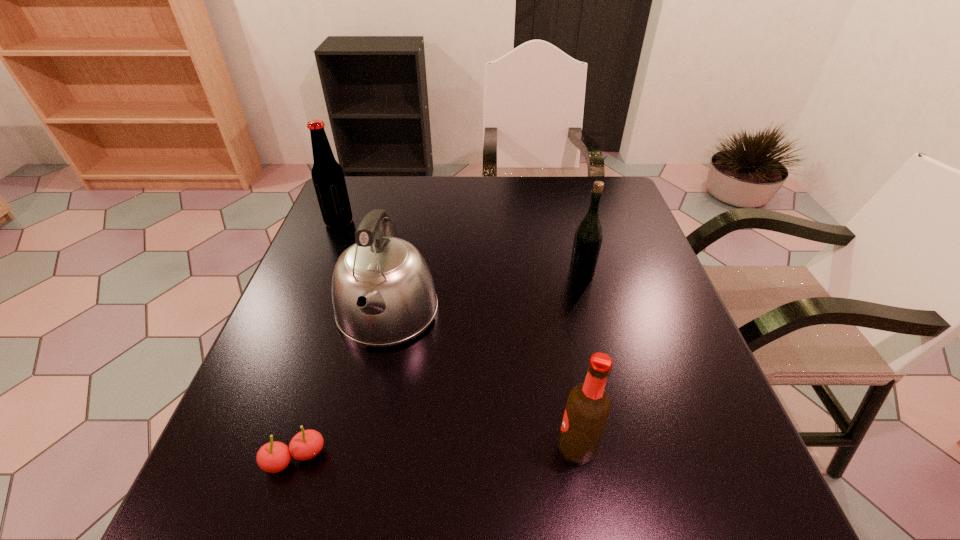
Identify the location of vacant area situated on the left of the rightmost object. [x=528, y=275].

This screenshot has height=540, width=960. I want to click on vacant area situated 0.050m on the back of the second beer bottle from right to left, so click(569, 403).

Locate an element on the screen. vacant space located 0.060m on the back of the cherry is located at coordinates (311, 408).

I want to click on object at the far edge, so click(328, 178).

The height and width of the screenshot is (540, 960). What are the coordinates of `object present at the near edge` in the screenshot? It's located at (273, 457).

Image resolution: width=960 pixels, height=540 pixels. Find the location of `beer bottle present at the left edge`. beer bottle present at the left edge is located at coordinates (328, 178).

What are the coordinates of `kettle present at the left edge` in the screenshot? It's located at [383, 294].

Where is `cherry that is at the left edge`? cherry that is at the left edge is located at coordinates (273, 457).

At what (x,y) coordinates should I click in order to perform the action: click on object that is at the far left corner. Please return your answer as a coordinate pair (x, y). Looking at the image, I should click on (328, 178).

Where is `object that is positioned at the near left corner`? This screenshot has width=960, height=540. object that is positioned at the near left corner is located at coordinates (273, 457).